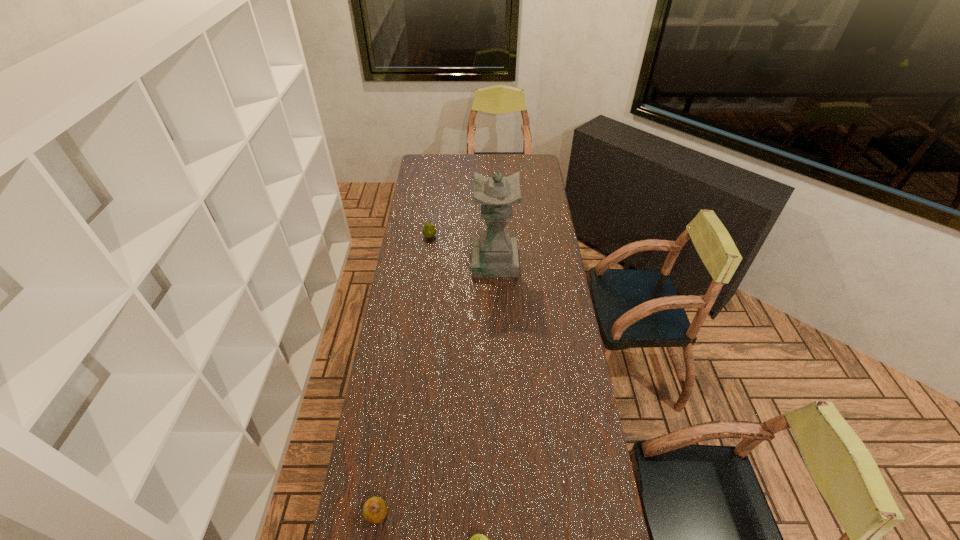
This screenshot has height=540, width=960. In order to click on vacant area at the left edge in this screenshot , I will do `click(426, 200)`.

Find the location of a particular element. The width and height of the screenshot is (960, 540). vacant space at the right edge is located at coordinates (558, 449).

Locate an element on the screen. This screenshot has width=960, height=540. free space at the far left corner of the desktop is located at coordinates pos(417,173).

In the image, there is a desktop. What are the coordinates of `vacant space at the far right corner` in the screenshot? It's located at (526, 156).

Where is `vacant area between the second nearest object and the farthest pear`? vacant area between the second nearest object and the farthest pear is located at coordinates (403, 375).

I want to click on vacant area that lies between the second nearest object and the sculpture, so click(x=436, y=387).

Select which object is the third closest to the third farthest object. Please provide its 2D coordinates. Your answer should be formatted as a tuple, i.e. [(x, y)], where the tuple contains the x and y coordinates of a point satisfying the conditions above.

[(429, 230)]

Where is `object that is the second closest to the nearest object`? This screenshot has height=540, width=960. object that is the second closest to the nearest object is located at coordinates (494, 253).

Select which pear appears as the second closest to the farthest pear. Please provide its 2D coordinates. Your answer should be formatted as a tuple, i.e. [(x, y)], where the tuple contains the x and y coordinates of a point satisfying the conditions above.

[(478, 539)]

This screenshot has width=960, height=540. I want to click on pear that stands as the second closest to the second nearest object, so click(x=429, y=230).